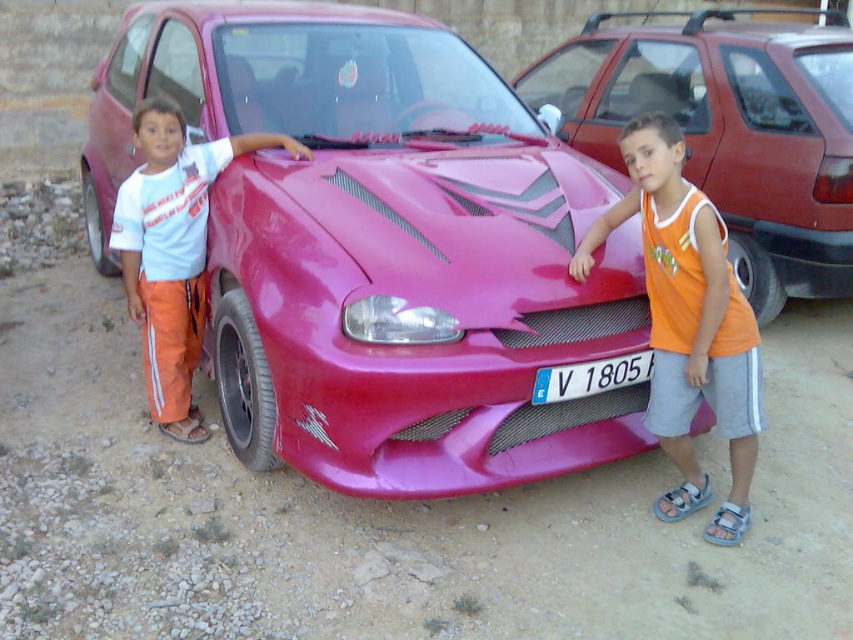
You are a delivery person who needs to park your van in a parking lot. The parking spot is exactly at coordinates 0.388, 0.448. You see the shiny pink car at center. Can you park your van in the parking spot?

The shiny pink car at center is already occupying the parking spot at coordinates (381, 248), so you cannot park your van there.

You are a photographer trying to capture both the shiny pink car at center and the glossy pink car at center in a single shot. Since the camera can only focus on one car at a time, which car should you choose to ensure it appears larger in the photo?

You should focus on the shiny pink car at center because it is bigger than the glossy pink car at center, making it appear larger in the photo.

You are a photographer trying to capture both the glossy pink car at center and the orange fabric shirt at center in a single frame. Given their sizes, which object should you focus on to ensure both are clearly visible in the photo?

The glossy pink car at center is larger than the orange fabric shirt at center, so focusing on the car will allow both objects to be clearly visible in the photo.